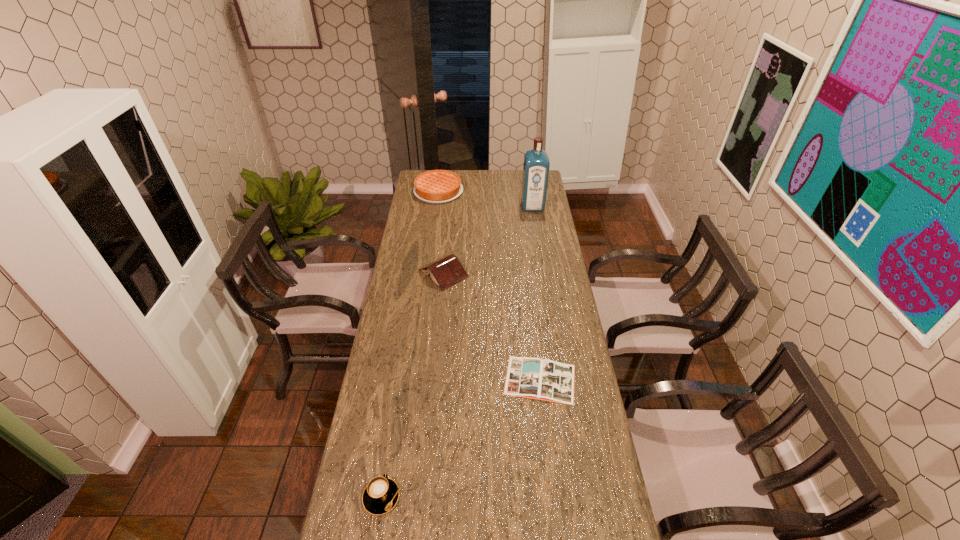
This screenshot has height=540, width=960. Identify the location of vacant region at the left edge of the desktop. (378, 468).

You are a GUI agent. You are given a task and a screenshot of the screen. Output one action in this format:
    pyautogui.click(x=<x>, y=<y>)
    Task: Click on the vacant space at the right edge
    
    Given the screenshot: What is the action you would take?
    tap(605, 483)

Locate an element on the screen. The width and height of the screenshot is (960, 540). free space between the pie and the shortest object is located at coordinates (490, 285).

Where is `vacant space that's between the fifth farthest object and the tallest object`? This screenshot has height=540, width=960. vacant space that's between the fifth farthest object and the tallest object is located at coordinates (457, 352).

The image size is (960, 540). In order to click on vacant space in between the tallest object and the third farthest object in this screenshot , I will do `click(488, 240)`.

Image resolution: width=960 pixels, height=540 pixels. I want to click on object that is the second closest one to the pie, so tap(446, 271).

The height and width of the screenshot is (540, 960). What are the coordinates of `object that can be found as the closest to the liquor` in the screenshot? It's located at (436, 186).

At what (x,y) coordinates should I click in order to perform the action: click on the second closest book to the tallest book. Please return your answer as a coordinate pair (x, y). Looking at the image, I should click on (555, 539).

The image size is (960, 540). What are the coordinates of `book that is the second closest one to the third farthest object` in the screenshot? It's located at (555, 539).

The width and height of the screenshot is (960, 540). In order to click on free space that satisfies the following two spatial constraints: 1. on the back side of the shortest object; 2. on the left side of the fifth farthest object in this screenshot , I will do `click(400, 380)`.